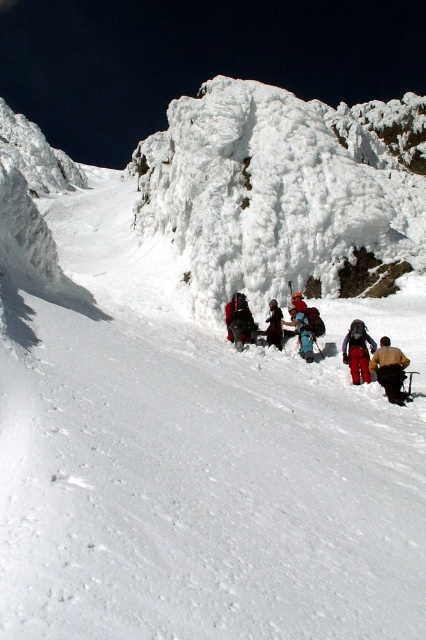
You are a photographer standing at the base of the mountain. You want to take a photo that includes both the yellow fabric jacket at lower right and the dark blue jacket at center. Which jacket will appear larger in the photo?

The yellow fabric jacket at lower right will appear larger in the photo because it is closer to the viewer than the dark blue jacket at center.

You are a climber preparing to pack your gear. You have a blue fabric backpack at center and a dark blue jacket at center. Which item can hold more items based on their sizes?

The blue fabric backpack at center has a larger size compared to the dark blue jacket at center, so it can hold more items.